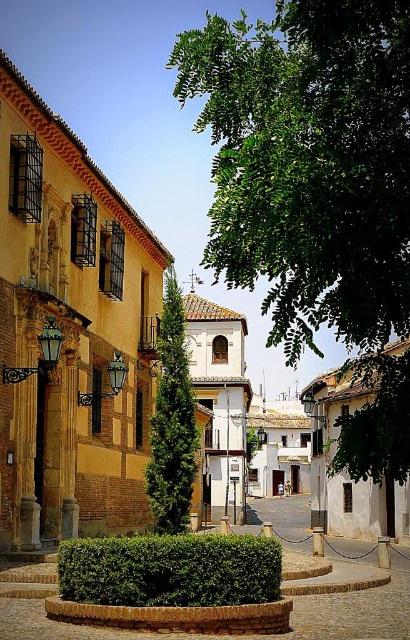
Does point (384, 250) come in front of point (148, 483)?

Yes, point (384, 250) is closer to viewer.

The height and width of the screenshot is (640, 410). Find the location of `green leafy tree at center`. green leafy tree at center is located at coordinates (316, 189).

You are a GUI agent. You are given a task and a screenshot of the screen. Output one action in this format:
    pyautogui.click(x=<x>, y=<y>)
    Task: Click on the green leafy tree at center
    
    Given the screenshot: What is the action you would take?
    pyautogui.click(x=316, y=189)

How far apart are green leafy hedge at center and green textured tree at center?

The distance of green leafy hedge at center from green textured tree at center is 19.43 meters.

At what (x,y) coordinates should I click in order to perform the action: click on green leafy hedge at center. Please return your answer as a coordinate pair (x, y). Image resolution: width=410 pixels, height=640 pixels. Looking at the image, I should click on (170, 570).

Between point (177, 595) and point (182, 372), which one is positioned in front?

Positioned in front is point (177, 595).

You are a GUI agent. You are given a task and a screenshot of the screen. Output one action in this format:
    pyautogui.click(x=<x>, y=<y>)
    Task: Click on the green leafy hedge at center
    
    Given the screenshot: What is the action you would take?
    pyautogui.click(x=170, y=570)

Between green leafy tree at center and green leafy hedge at center, which one is positioned higher?

green leafy tree at center

You are a GUI agent. You are given a task and a screenshot of the screen. Output one action in this format:
    pyautogui.click(x=<x>, y=<y>)
    Task: Click on the green leafy tree at center
    
    Given the screenshot: What is the action you would take?
    pyautogui.click(x=316, y=189)